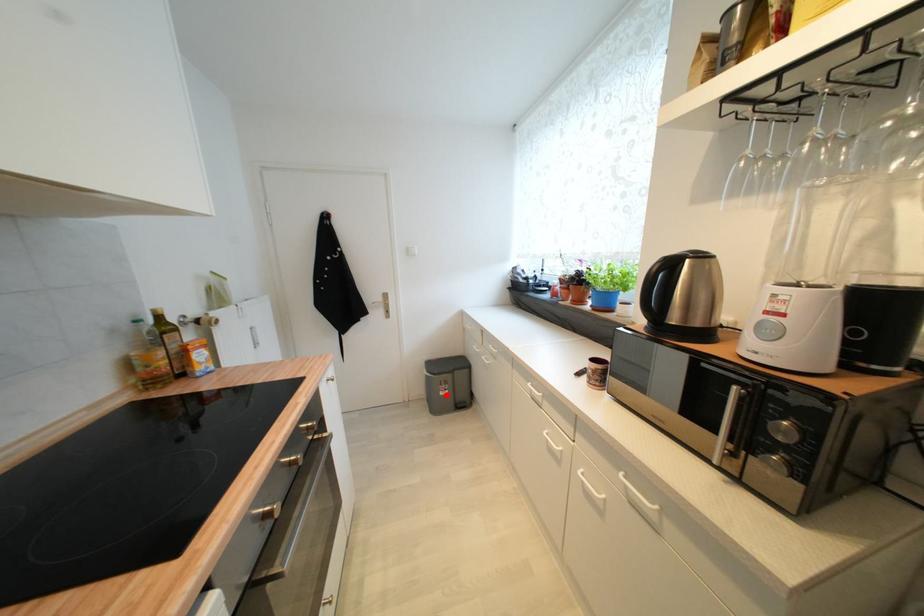
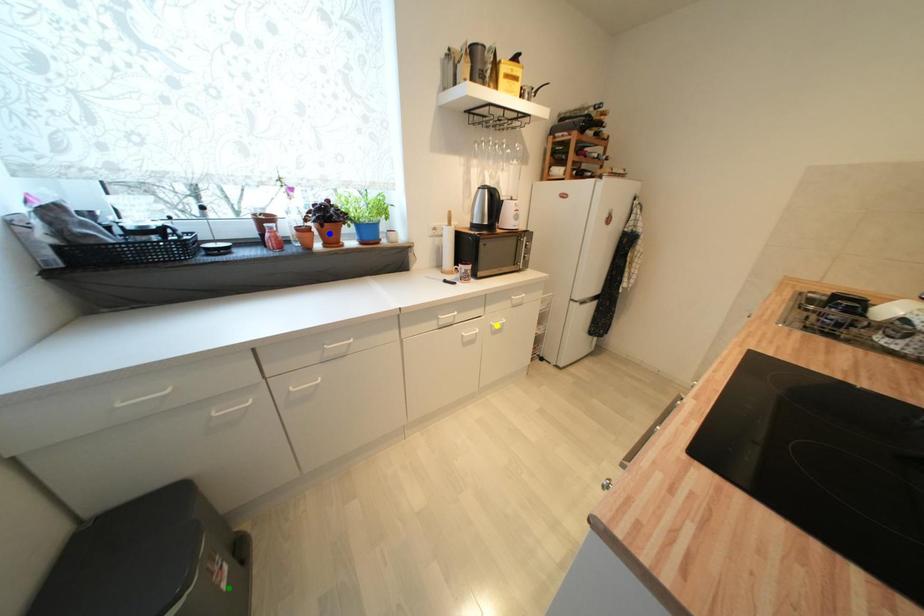
Question: I am providing you with two images of the same scene from different viewpoints. A red point is marked on the first image. You are given multiple points on the second image. In image 2, which mark is for the same physical point as the one in image 1?

Choices:
 (A) blue point
 (B) yellow point
 (C) green point

Answer: (C)